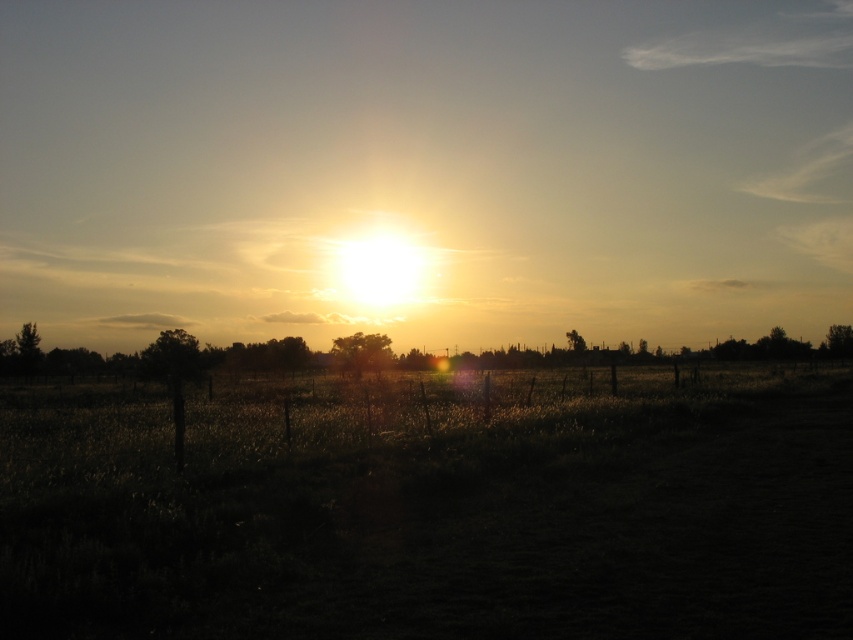
Question: Which point is closer to the camera taking this photo?

Choices:
 (A) (152, 264)
 (B) (795, 458)

Answer: (B)

Question: Is golden sky at center further to the viewer compared to dark grass at center?

Choices:
 (A) yes
 (B) no

Answer: (A)

Question: Can you confirm if golden sky at center is thinner than dark grass at center?

Choices:
 (A) no
 (B) yes

Answer: (A)

Question: Can you confirm if golden sky at center is positioned to the left of dark grass at center?

Choices:
 (A) yes
 (B) no

Answer: (B)